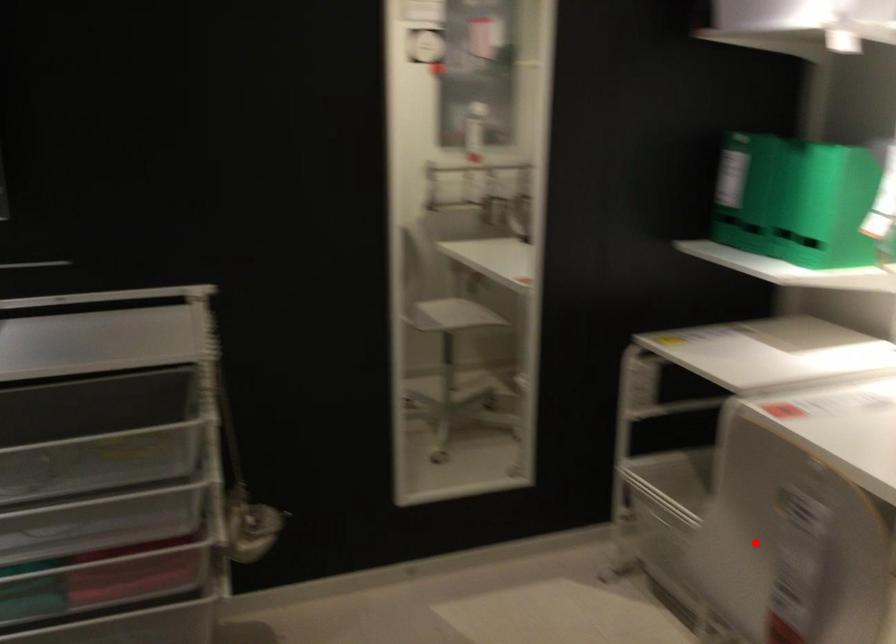
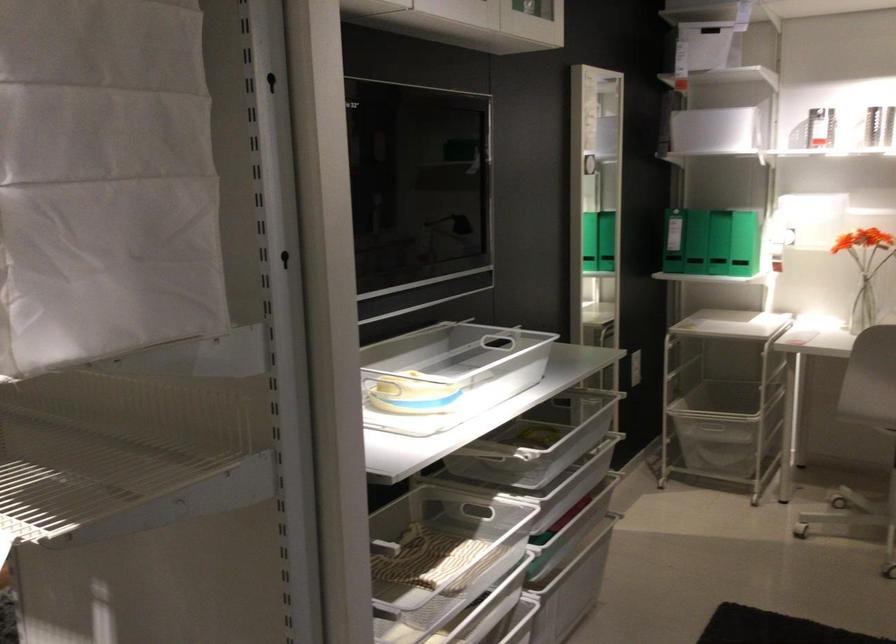
Question: I am providing you with two images of the same scene from different viewpoints. A red point is shown in image1. For the corresponding object point in image2, is it positioned nearer or farther from the camera?

Choices:
 (A) Nearer
 (B) Farther

Answer: (B)